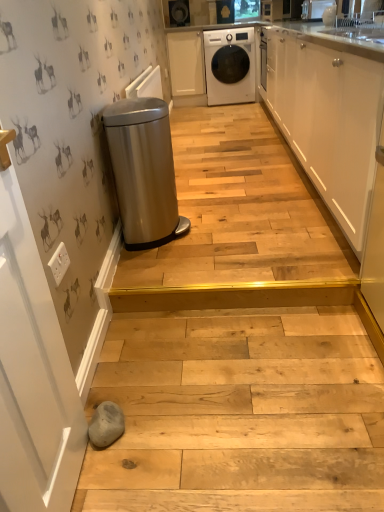
Question: Is white glossy vase at upper center situated inside stainless steel trash can at left or outside?

Choices:
 (A) outside
 (B) inside

Answer: (A)

Question: Considering the positions of white glossy vase at upper center and stainless steel trash can at left in the image, is white glossy vase at upper center taller or shorter than stainless steel trash can at left?

Choices:
 (A) tall
 (B) short

Answer: (B)

Question: Which of these objects is positioned farthest from the white glossy vase at upper center?

Choices:
 (A) white glossy cabinet at upper right, arranged as the second cabinetry when viewed from the top
 (B) stainless steel trash can at left
 (C) white glossy washing machine at upper center
 (D) white matte cabinet at center, the first cabinetry when ordered from back to front

Answer: (B)

Question: Which of these objects is positioned farthest from the white glossy vase at upper center?

Choices:
 (A) white matte cabinet at center, the 2th cabinetry from the front
 (B) white glossy cabinet at upper right, arranged as the second cabinetry when viewed from the top
 (C) stainless steel trash can at left
 (D) white glossy washing machine at upper center

Answer: (C)